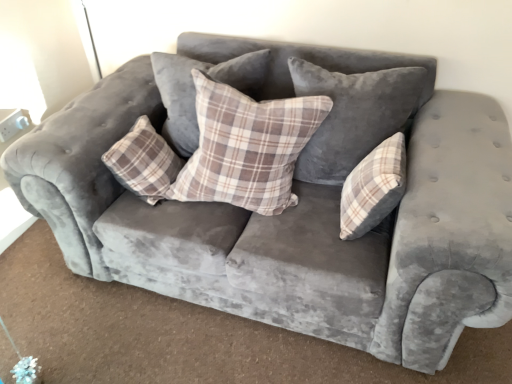
Question: Is velvet plaid pillow at center, the third pillow when ordered from left to right, to the left or to the right of plaid fabric pillow at center, which is the fourth pillow in right-to-left order, in the image?

Choices:
 (A) right
 (B) left

Answer: (A)

Question: From a real-world perspective, relative to plaid fabric pillow at center, which is the fourth pillow in right-to-left order, is velvet plaid pillow at center, which ranks as the second pillow in right-to-left order, vertically above or below?

Choices:
 (A) below
 (B) above

Answer: (B)

Question: Estimate the real-world distances between objects in this image. Which object is closer to the velvet plaid pillow at center, the third pillow when ordered from left to right?

Choices:
 (A) plaid fabric pillow at center, which is the 3th pillow from right to left
 (B) plaid fabric pillow at center, arranged as the first pillow when viewed from the left
 (C) plaid fabric pillow at center, placed as the first pillow when sorted from right to left

Answer: (C)

Question: Estimate the real-world distances between objects in this image. Which object is closer to the plaid fabric pillow at center, which is the fourth pillow in left-to-right order?

Choices:
 (A) plaid fabric pillow at center, which is counted as the 2th pillow, starting from the left
 (B) plaid fabric pillow at center, which is the fourth pillow in right-to-left order
 (C) velvet plaid pillow at center, which ranks as the second pillow in right-to-left order

Answer: (C)